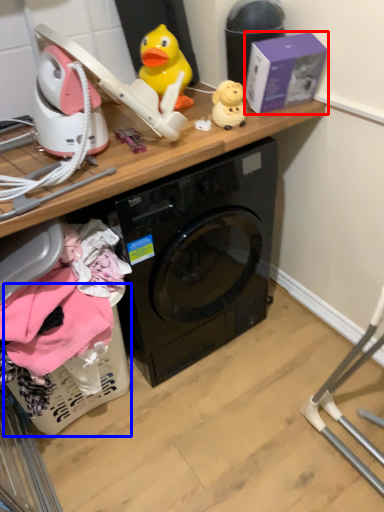
Question: Among these objects, which one is nearest to the camera, box (highlighted by a red box) or basket (highlighted by a blue box)?

Choices:
 (A) box
 (B) basket

Answer: (B)